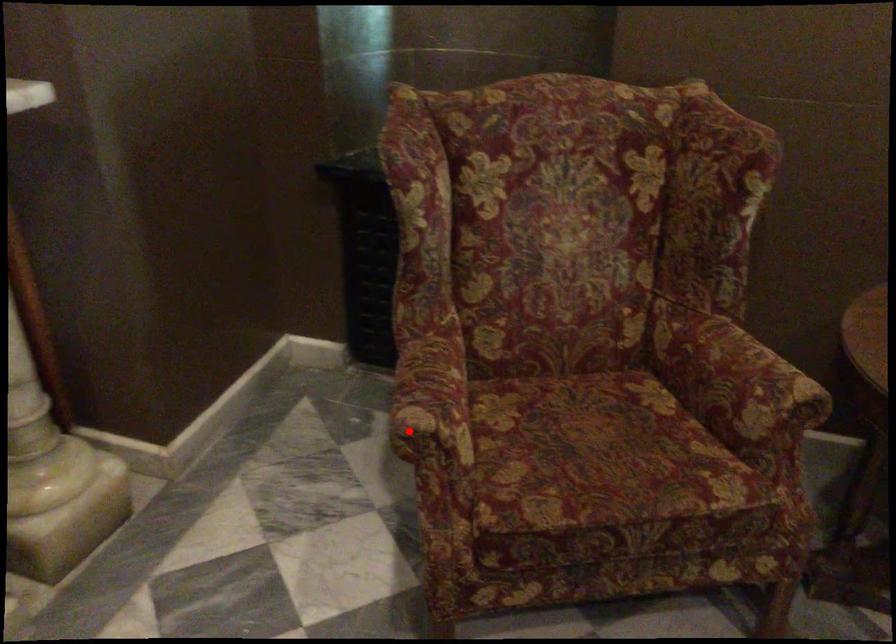
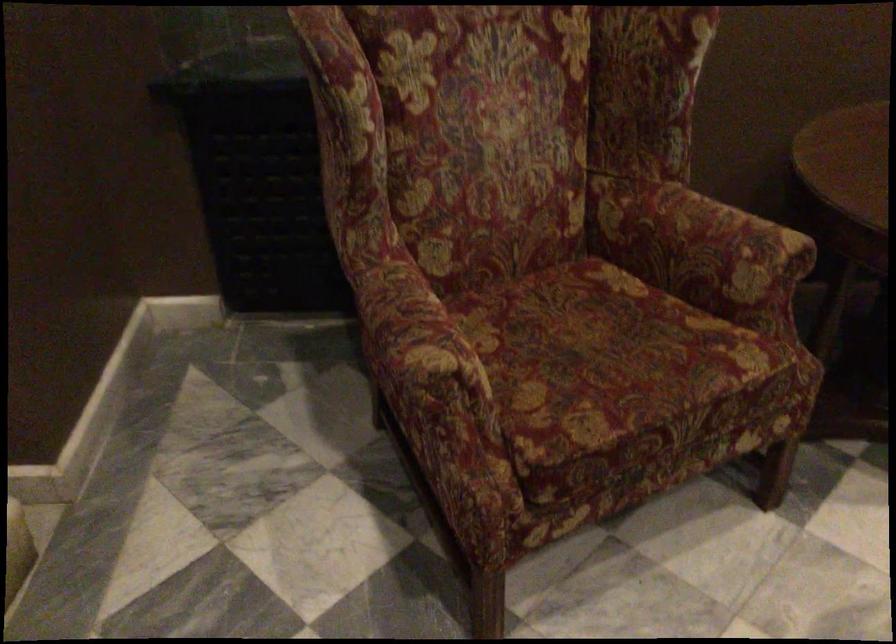
Question: I am providing you with two images of the same scene from different viewpoints. Image1 has a red point marked. In image2, the corresponding 3D location appears at what relative position? Reply with the corresponding letter.

Choices:
 (A) Closer
 (B) Farther

Answer: (A)